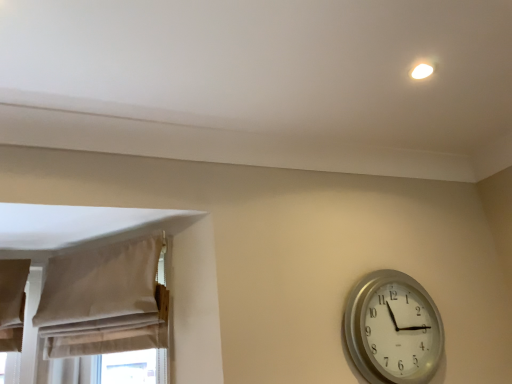
Question: Is point (71, 326) positioned closer to the camera than point (409, 319)?

Choices:
 (A) closer
 (B) farther

Answer: (A)

Question: From a real-world perspective, is beige fabric curtain at left above or below silver metallic wall clock at lower right?

Choices:
 (A) below
 (B) above

Answer: (B)

Question: Is beige fabric curtain at left in front of or behind silver metallic wall clock at lower right in the image?

Choices:
 (A) front
 (B) behind

Answer: (A)

Question: Considering the positions of silver metallic wall clock at lower right and beige fabric curtain at left in the image, is silver metallic wall clock at lower right wider or thinner than beige fabric curtain at left?

Choices:
 (A) wide
 (B) thin

Answer: (B)

Question: Based on their sizes in the image, would you say silver metallic wall clock at lower right is bigger or smaller than beige fabric curtain at left?

Choices:
 (A) small
 (B) big

Answer: (A)

Question: Based on their positions, is silver metallic wall clock at lower right located to the left or right of beige fabric curtain at left?

Choices:
 (A) left
 (B) right

Answer: (B)

Question: From the image's perspective, relative to beige fabric curtain at left, is silver metallic wall clock at lower right above or below?

Choices:
 (A) below
 (B) above

Answer: (A)